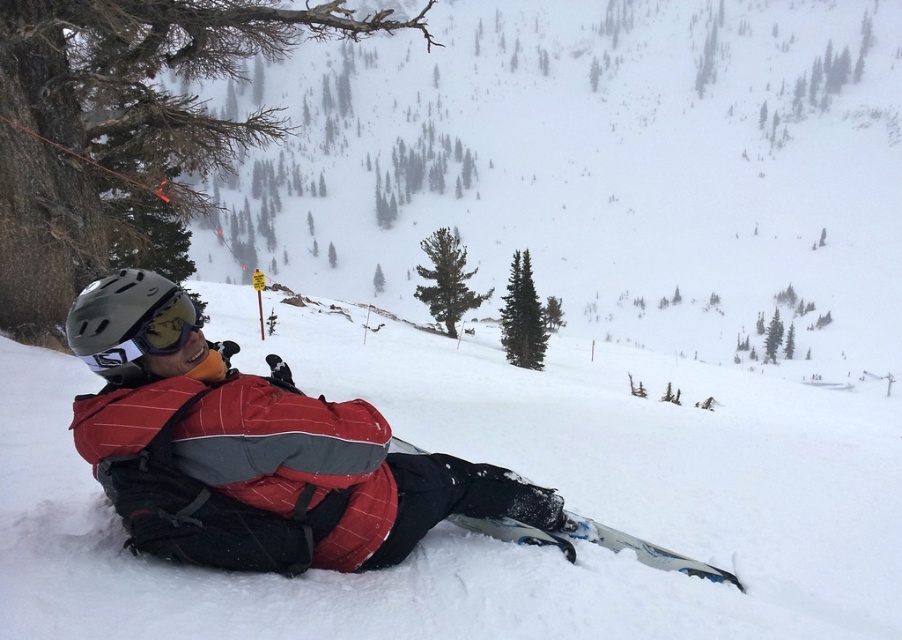
Question: Considering the relative positions of matte gray helmet at left and blue metallic ski at lower right in the image provided, where is matte gray helmet at left located with respect to blue metallic ski at lower right?

Choices:
 (A) below
 (B) above

Answer: (B)

Question: Does red matte jacket at center appear under blue metallic ski at lower right?

Choices:
 (A) no
 (B) yes

Answer: (A)

Question: Which is farther from the red matte jacket at center?

Choices:
 (A) matte gray helmet at left
 (B) blue metallic ski at lower right

Answer: (A)

Question: Does red matte jacket at center have a greater width compared to blue metallic ski at lower right?

Choices:
 (A) no
 (B) yes

Answer: (B)

Question: Which point is closer to the camera taking this photo?

Choices:
 (A) (498, 486)
 (B) (176, 317)
 (C) (680, 568)

Answer: (B)

Question: Which point is closer to the camera taking this photo?

Choices:
 (A) (100, 349)
 (B) (451, 504)

Answer: (A)